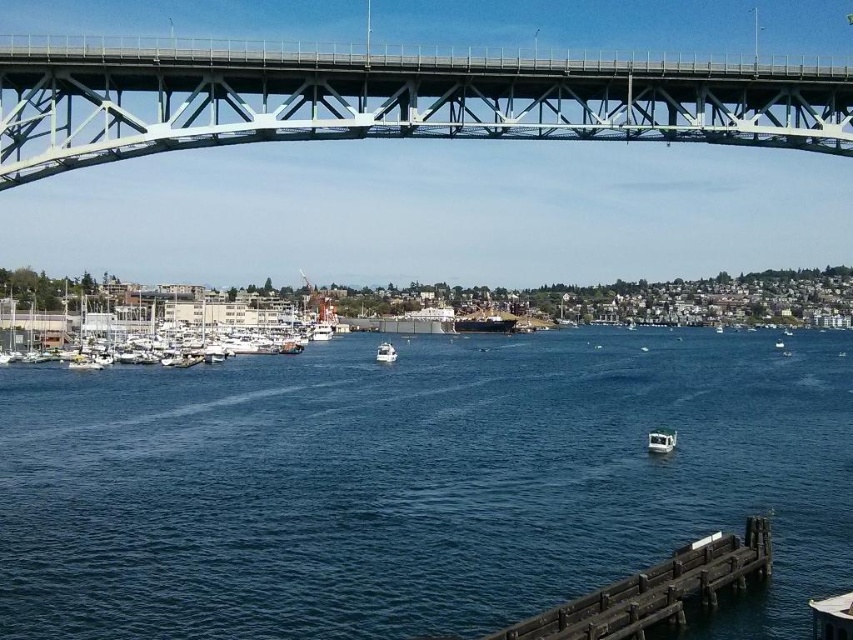
Does blue water at center have a smaller size compared to white glossy boat at center?

Actually, blue water at center might be larger than white glossy boat at center.

Is blue water at center closer to camera compared to white glossy boat at center?

Yes, it is in front of white glossy boat at center.

Which is behind, point (346, 348) or point (381, 349)?

The point (346, 348) is more distant.

Locate an element on the screen. The width and height of the screenshot is (853, 640). blue water at center is located at coordinates (416, 483).

Is gray metallic bridge at upper center smaller than white matte boats at lower left?

Actually, gray metallic bridge at upper center might be larger than white matte boats at lower left.

Is point (335, 122) closer to viewer compared to point (190, 358)?

Yes, it is.

You are a GUI agent. You are given a task and a screenshot of the screen. Output one action in this format:
    pyautogui.click(x=<x>, y=<y>)
    Task: Click on the gray metallic bridge at upper center
    
    Given the screenshot: What is the action you would take?
    pyautogui.click(x=389, y=100)

Is white matte boats at lower left to the right of wooden pier at lower right from the viewer's perspective?

Incorrect, white matte boats at lower left is not on the right side of wooden pier at lower right.

Locate an element on the screen. The height and width of the screenshot is (640, 853). white matte boats at lower left is located at coordinates (155, 323).